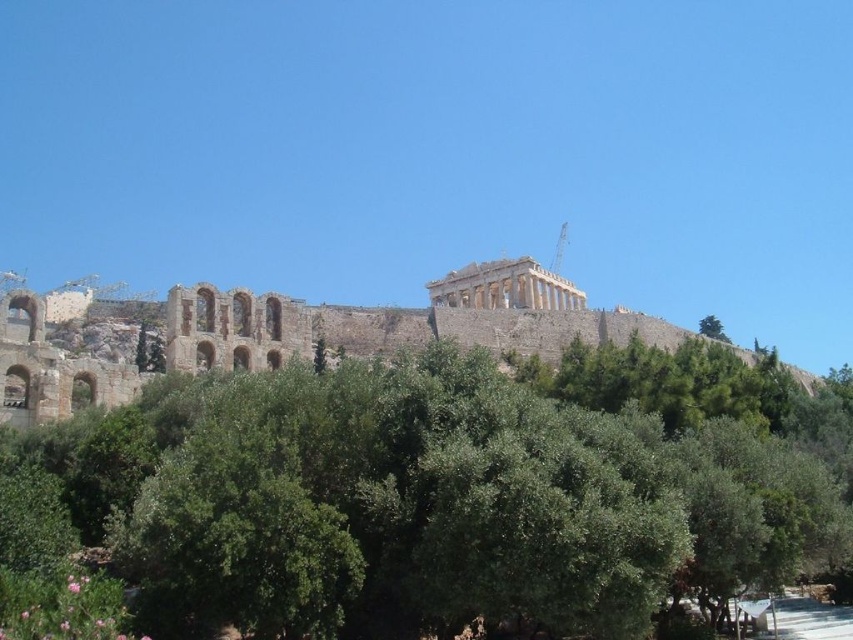
You are a tourist standing at the base of the Acropolis and want to take a photo of the Parthenon temple. However, you notice two green leafy trees blocking your view. Which tree, the green leafy tree at center or the green leafy tree at upper center, is closer to you?

The green leafy tree at center is positioned under the green leafy tree at upper center, meaning it is closer to you.

You are a tourist standing at the base of the Acropolis, looking up at the green leafy tree at center and the stone amphitheater at center. Which structure is taller?

The green leafy tree at center is shorter than the stone amphitheater at center, so the stone amphitheater at center is taller.